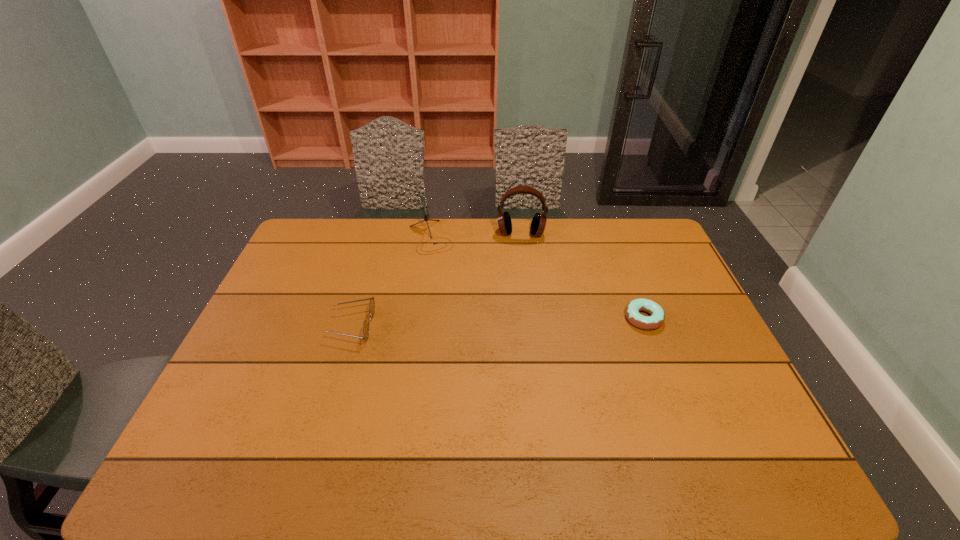
In order to click on the leftmost object in this screenshot , I will do `click(372, 304)`.

This screenshot has width=960, height=540. Find the location of `spectacles`. spectacles is located at coordinates (372, 304).

Image resolution: width=960 pixels, height=540 pixels. In order to click on the shortest object in this screenshot , I will do `click(657, 317)`.

In order to click on the rightmost object in this screenshot , I will do `click(657, 317)`.

At what (x,y) coordinates should I click in order to perform the action: click on the second object from left to right. Please return your answer as a coordinate pair (x, y). The image size is (960, 540). Looking at the image, I should click on (423, 202).

I want to click on the second tallest object, so click(423, 202).

Image resolution: width=960 pixels, height=540 pixels. I want to click on headset, so click(x=538, y=223).

Image resolution: width=960 pixels, height=540 pixels. I want to click on the tallest object, so click(538, 223).

This screenshot has height=540, width=960. Identify the location of vacant area located on the front-facing side of the third tallest object. (308, 326).

This screenshot has height=540, width=960. What are the coordinates of `free region located on the front-facing side of the third tallest object` in the screenshot? It's located at (312, 326).